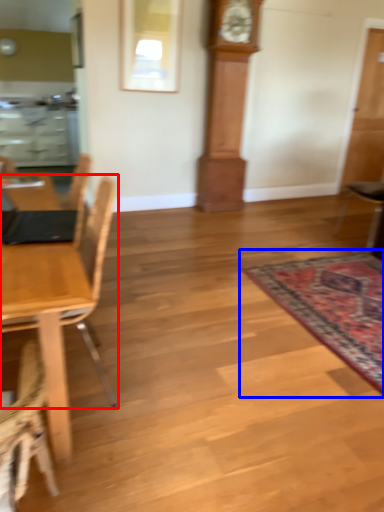
Question: Which of the following is the closest to the observer, chair (highlighted by a red box) or mat (highlighted by a blue box)?

Choices:
 (A) chair
 (B) mat

Answer: (A)